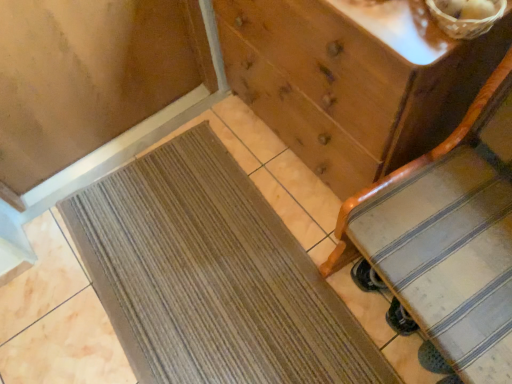
The width and height of the screenshot is (512, 384). Describe the element at coordinates (463, 20) in the screenshot. I see `brown woven basket at upper right` at that location.

In order to click on brown woven basket at upper right in this screenshot , I will do 463,20.

Does brown woven mat at lower left appear on the right side of brown woven basket at upper right?

No.

Is point (216, 205) farther from viewer compared to point (449, 24)?

Yes, it is.

Is brown woven basket at upper right completely or partially inside brown woven mat at lower left?

Definitely not — brown woven basket at upper right is not inside brown woven mat at lower left.

Is brown woven mat at lower left positioned before brown woven basket at upper right?

No, brown woven mat at lower left is further to the viewer.

Where is `doormat behind the wooden chest of drawers at center`? The width and height of the screenshot is (512, 384). doormat behind the wooden chest of drawers at center is located at coordinates (212, 276).

Could you tell me if brown woven mat at lower left is facing wooden chest of drawers at center?

No, brown woven mat at lower left is not oriented towards wooden chest of drawers at center.

From the image's perspective, which one is positioned lower, brown woven mat at lower left or wooden chest of drawers at center?

brown woven mat at lower left is shown below in the image.

How distant is brown woven mat at lower left from wooden chest of drawers at center?

A distance of 21.25 inches exists between brown woven mat at lower left and wooden chest of drawers at center.

What's the angular difference between wooden chest of drawers at center and striped fabric suitcase at right's facing directions?

A: 6 degrees.

Visually, is wooden chest of drawers at center positioned to the left or to the right of striped fabric suitcase at right?

In the image, wooden chest of drawers at center appears on the left side of striped fabric suitcase at right.

Is wooden chest of drawers at center inside the boundaries of striped fabric suitcase at right, or outside?

wooden chest of drawers at center is outside striped fabric suitcase at right.

Is striped fabric suitcase at right positioned with its back to brown woven basket at upper right?

striped fabric suitcase at right does not have its back to brown woven basket at upper right.

From a real-world perspective, is striped fabric suitcase at right below brown woven basket at upper right?

Yes, from a real-world perspective, striped fabric suitcase at right is under brown woven basket at upper right.

You are a GUI agent. You are given a task and a screenshot of the screen. Output one action in this format:
    pyautogui.click(x=<x>, y=<y>)
    Task: Click on the furniture in front of the brown woven basket at upper right
    
    Given the screenshot: What is the action you would take?
    pyautogui.click(x=448, y=237)

In the image, is striped fabric suitcase at right positioned in front of or behind brown woven basket at upper right?

In the image, striped fabric suitcase at right appears in front of brown woven basket at upper right.

From a real-world perspective, which object stands above the other?

brown woven basket at upper right is physically above.

Who is bigger, brown woven basket at upper right or brown woven mat at lower left?

brown woven mat at lower left is bigger.

Based on the photo, which object is wider, brown woven basket at upper right or brown woven mat at lower left?

With larger width is brown woven mat at lower left.

Is brown woven mat at lower left at the back of brown woven basket at upper right?

brown woven basket at upper right is not turned away from brown woven mat at lower left.

Considering the sizes of brown woven basket at upper right and wooden chest of drawers at center in the image, is brown woven basket at upper right taller or shorter than wooden chest of drawers at center?

Considering their sizes, brown woven basket at upper right has less height than wooden chest of drawers at center.

Are brown woven basket at upper right and wooden chest of drawers at center located far from each other?

brown woven basket at upper right is actually quite close to wooden chest of drawers at center.

Considering the relative positions of brown woven basket at upper right and wooden chest of drawers at center in the image provided, is brown woven basket at upper right in front of wooden chest of drawers at center?

That is True.

Visually, is brown woven basket at upper right positioned to the left or to the right of wooden chest of drawers at center?

brown woven basket at upper right is to the right of wooden chest of drawers at center.

In terms of size, does wooden chest of drawers at center appear bigger or smaller than brown woven basket at upper right?

Considering their sizes, wooden chest of drawers at center takes up more space than brown woven basket at upper right.

In the scene shown: Between wooden chest of drawers at center and brown woven basket at upper right, which one is positioned in front?

brown woven basket at upper right is closer to the camera.

Identify the location of doormat lying below the brown woven basket at upper right (from the image's perspective). (212, 276).

Identify the location of chest of drawers that is on the right side of brown woven mat at lower left. The width and height of the screenshot is (512, 384). (353, 80).

From the picture: Considering their positions, is brown woven basket at upper right positioned closer to brown woven mat at lower left than striped fabric suitcase at right?

striped fabric suitcase at right is closer to brown woven mat at lower left.

Looking at the image, which one is located further to brown woven mat at lower left, striped fabric suitcase at right or brown woven basket at upper right?

brown woven basket at upper right lies further to brown woven mat at lower left than the other object.

Considering their positions, is brown woven basket at upper right positioned closer to wooden chest of drawers at center than striped fabric suitcase at right?

striped fabric suitcase at right lies closer to wooden chest of drawers at center than the other object.

Based on their spatial positions, is striped fabric suitcase at right or brown woven mat at lower left closer to wooden chest of drawers at center?

striped fabric suitcase at right lies closer to wooden chest of drawers at center than the other object.

Considering their positions, is brown woven mat at lower left positioned further to striped fabric suitcase at right than wooden chest of drawers at center?

brown woven mat at lower left lies further to striped fabric suitcase at right than the other object.

Consider the image. Looking at the image, which one is located further to wooden chest of drawers at center, brown woven basket at upper right or brown woven mat at lower left?

Based on the image, brown woven mat at lower left appears to be further to wooden chest of drawers at center.

When comparing their distances from brown woven mat at lower left, does wooden chest of drawers at center or striped fabric suitcase at right seem further?

striped fabric suitcase at right is positioned further to the anchor brown woven mat at lower left.

Estimate the real-world distances between objects in this image. Which object is closer to brown woven basket at upper right, wooden chest of drawers at center or brown woven mat at lower left?

Based on the image, wooden chest of drawers at center appears to be nearer to brown woven basket at upper right.

What are the coordinates of `basket between wooden chest of drawers at center and striped fabric suitcase at right in the vertical direction` in the screenshot? It's located at (463, 20).

Identify the location of basket situated between brown woven mat at lower left and striped fabric suitcase at right from left to right. This screenshot has height=384, width=512. (463, 20).

The height and width of the screenshot is (384, 512). Find the location of `basket between wooden chest of drawers at center and brown woven mat at lower left from top to bottom`. basket between wooden chest of drawers at center and brown woven mat at lower left from top to bottom is located at coordinates (463, 20).

Identify the location of furniture that lies between wooden chest of drawers at center and brown woven mat at lower left from top to bottom. (448, 237).